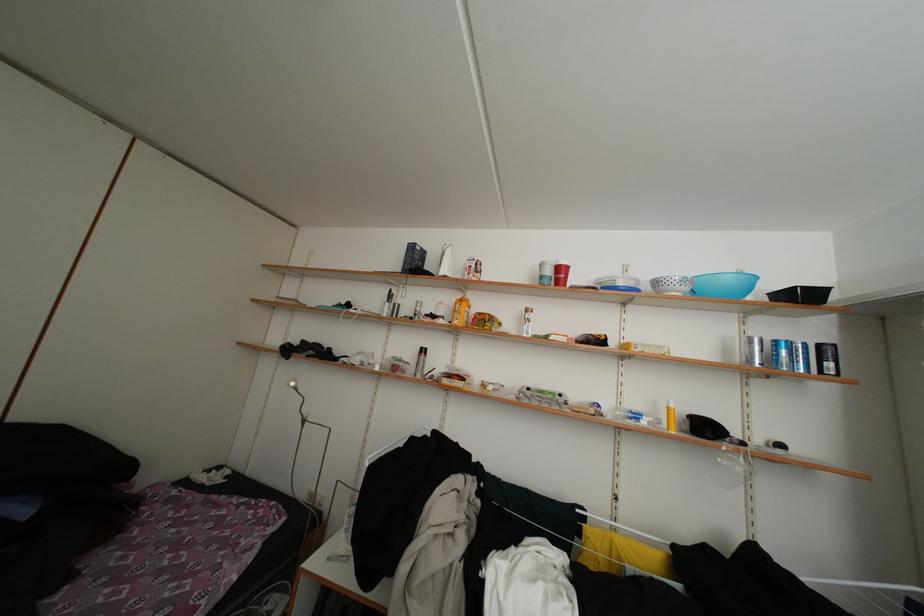
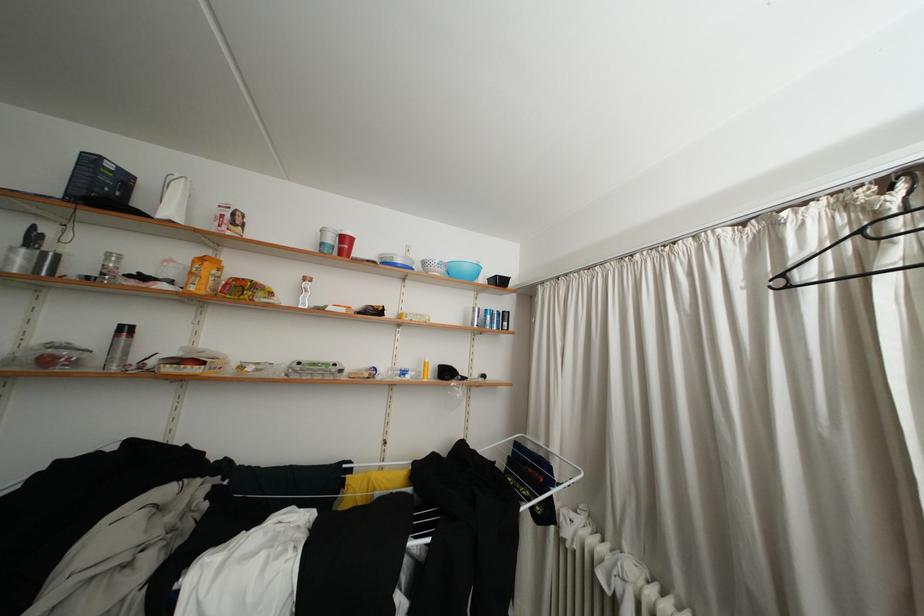
Locate, in the second image, the point that corresponds to [391,314] in the first image.

(17, 264)